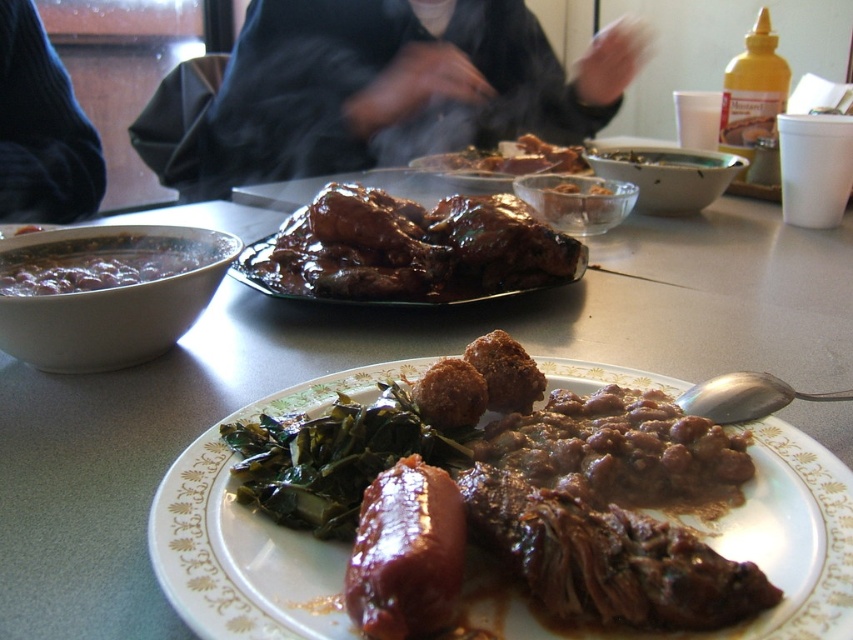
From the picture: You are a chef standing at the counter and want to place a new dish on the table. You see the black matte jacket at upper center and the glossy brown meat at center. Which object is taller so you can decide where to place the dish?

The black matte jacket at upper center is taller than the glossy brown meat at center, so you should place the dish where it won

You are a food critic analyzing the presentation of the meal. The black matte jacket at upper center and glossy brown meat at center are both visible in your view. Which object takes up more visual space in the image?

The black matte jacket at upper center has a larger size compared to glossy brown meat at center, so it takes up more visual space in the image.